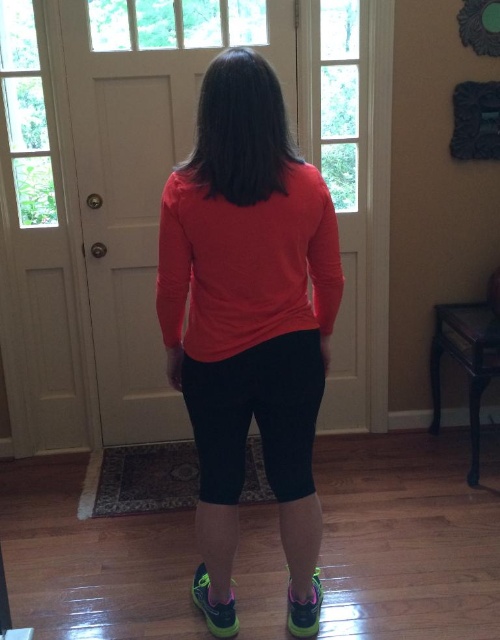
Does matte orange long-sleeve shirt at center have a greater width compared to neon green mesh shoe at lower center?

Yes.

Is matte orange long-sleeve shirt at center taller than neon green mesh shoe at lower center?

Indeed, matte orange long-sleeve shirt at center has a greater height compared to neon green mesh shoe at lower center.

Is point (263, 305) more distant than point (315, 625)?

No, (263, 305) is in front of (315, 625).

Image resolution: width=500 pixels, height=640 pixels. Identify the location of matte orange long-sleeve shirt at center. (249, 308).

Who is positioned more to the right, matte red shirt at center or neon green mesh sneaker at lower center?

matte red shirt at center is more to the right.

Does matte red shirt at center have a lesser width compared to neon green mesh sneaker at lower center?

No.

Who is more distant from viewer, (301, 268) or (207, 586)?

Positioned behind is point (207, 586).

Where is `matte red shirt at center`? matte red shirt at center is located at coordinates (246, 264).

Which of these two, matte orange long-sleeve shirt at center or matte red shirt at center, stands shorter?

matte red shirt at center is shorter.

Can you confirm if matte orange long-sleeve shirt at center is positioned to the right of matte red shirt at center?

In fact, matte orange long-sleeve shirt at center is to the left of matte red shirt at center.

Is point (235, 266) in front of point (238, 237)?

No, it is behind (238, 237).

Where is `matte orange long-sleeve shirt at center`? The width and height of the screenshot is (500, 640). matte orange long-sleeve shirt at center is located at coordinates (249, 308).